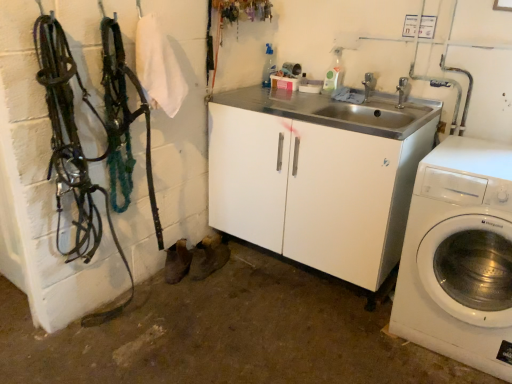
Question: Is silver metallic faucet at upper center, the second faucet in the back-to-front sequence, turned away from silver metallic faucet at upper center, positioned as the 1th faucet in back-to-front order?

Choices:
 (A) no
 (B) yes

Answer: (A)

Question: From a real-world perspective, is silver metallic faucet at upper center, acting as the first faucet starting from the front, over silver metallic faucet at upper center, positioned as the 2th faucet in right-to-left order?

Choices:
 (A) no
 (B) yes

Answer: (A)

Question: Is silver metallic faucet at upper center, acting as the first faucet starting from the front, not inside silver metallic faucet at upper center, which is counted as the 1th faucet, starting from the left?

Choices:
 (A) yes
 (B) no

Answer: (A)

Question: Are silver metallic faucet at upper center, the second faucet in the back-to-front sequence, and silver metallic faucet at upper center, positioned as the 2th faucet in right-to-left order, making contact?

Choices:
 (A) no
 (B) yes

Answer: (A)

Question: From the image's perspective, would you say silver metallic faucet at upper center, acting as the second faucet starting from the left, is positioned over silver metallic faucet at upper center, positioned as the 1th faucet in back-to-front order?

Choices:
 (A) no
 (B) yes

Answer: (A)

Question: From a real-world perspective, is silver metallic faucet at upper center, acting as the second faucet starting from the left, beneath silver metallic faucet at upper center, positioned as the 2th faucet in right-to-left order?

Choices:
 (A) yes
 (B) no

Answer: (A)

Question: Is silver metallic faucet at upper center, the 1th faucet when ordered from right to left, looking in the opposite direction of white plastic washing machine at right?

Choices:
 (A) no
 (B) yes

Answer: (A)

Question: Can you confirm if silver metallic faucet at upper center, the 1th faucet when ordered from right to left, is thinner than white plastic washing machine at right?

Choices:
 (A) no
 (B) yes

Answer: (B)

Question: Can you confirm if silver metallic faucet at upper center, acting as the first faucet starting from the front, is shorter than white plastic washing machine at right?

Choices:
 (A) no
 (B) yes

Answer: (B)

Question: Is silver metallic faucet at upper center, acting as the second faucet starting from the left, outside of white plastic washing machine at right?

Choices:
 (A) no
 (B) yes

Answer: (B)

Question: From a real-world perspective, does silver metallic faucet at upper center, acting as the first faucet starting from the front, stand above white plastic washing machine at right?

Choices:
 (A) no
 (B) yes

Answer: (B)

Question: Considering the relative positions of silver metallic faucet at upper center, the second faucet in the back-to-front sequence, and white plastic washing machine at right in the image provided, is silver metallic faucet at upper center, the second faucet in the back-to-front sequence, to the right of white plastic washing machine at right from the viewer's perspective?

Choices:
 (A) no
 (B) yes

Answer: (A)

Question: Is silver metallic faucet at upper center, which is counted as the 1th faucet, starting from the left, behind white plastic washing machine at right?

Choices:
 (A) yes
 (B) no

Answer: (A)